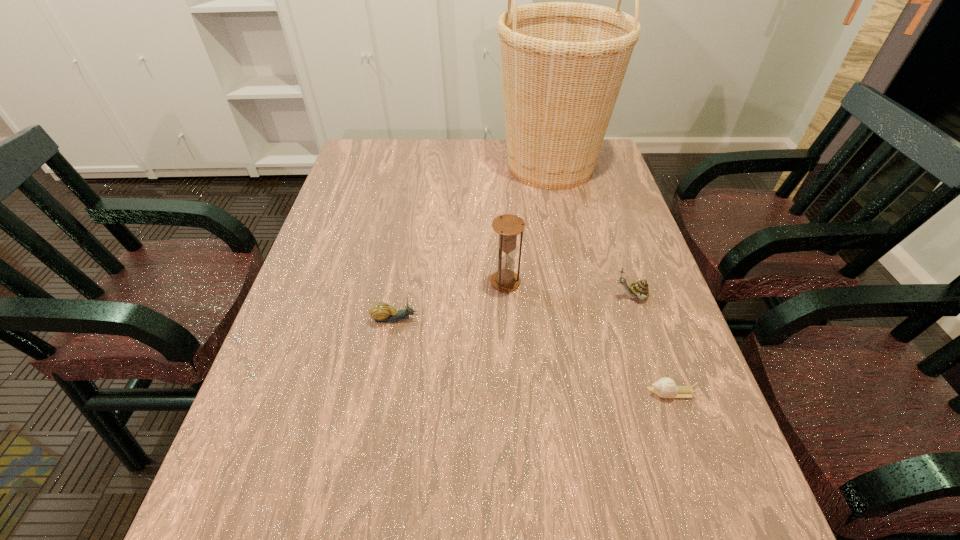
The height and width of the screenshot is (540, 960). What are the coordinates of `free spot located on the left of the hourglass` in the screenshot? It's located at (416, 282).

At what (x,y) coordinates should I click in order to perform the action: click on blank area located 0.110m on the face of the third shortest object. Please return your answer as a coordinate pair (x, y). The height and width of the screenshot is (540, 960). Looking at the image, I should click on (565, 296).

Image resolution: width=960 pixels, height=540 pixels. In order to click on vacant space located 0.090m on the face of the third shortest object in this screenshot , I will do `click(574, 296)`.

Identify the location of vacant region located on the face of the third shortest object. tap(515, 296).

The width and height of the screenshot is (960, 540). Find the location of `vacant space located on the front-facing side of the fourth farthest object`. vacant space located on the front-facing side of the fourth farthest object is located at coordinates pos(514,319).

Identify the location of free region located 0.130m on the shell of the shortest object. The image size is (960, 540). (580, 393).

At what (x,y) coordinates should I click in order to perform the action: click on free region located 0.240m on the shell of the shortest object. Please return your answer as a coordinate pair (x, y). Looking at the image, I should click on (523, 393).

Image resolution: width=960 pixels, height=540 pixels. Find the location of `vacant region located on the shell of the shortest object`. vacant region located on the shell of the shortest object is located at coordinates (586, 393).

You are a GUI agent. You are given a task and a screenshot of the screen. Output one action in this format:
    pyautogui.click(x=<x>, y=<y>)
    Task: Click on the object that is at the far edge
    Image resolution: width=960 pixels, height=540 pixels.
    Given the screenshot: What is the action you would take?
    pyautogui.click(x=563, y=63)

Where is `basket that is at the right edge`? The image size is (960, 540). basket that is at the right edge is located at coordinates (563, 63).